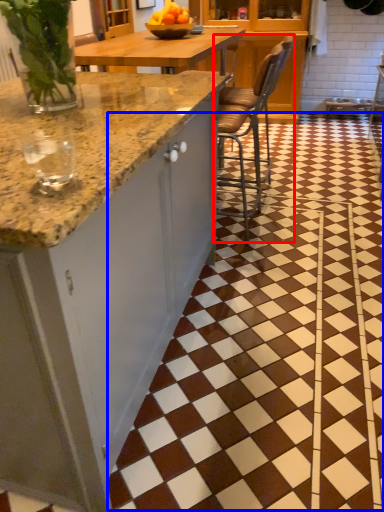
Question: Which object is further to the camera taking this photo, chair (highlighted by a red box) or tile (highlighted by a blue box)?

Choices:
 (A) chair
 (B) tile

Answer: (A)